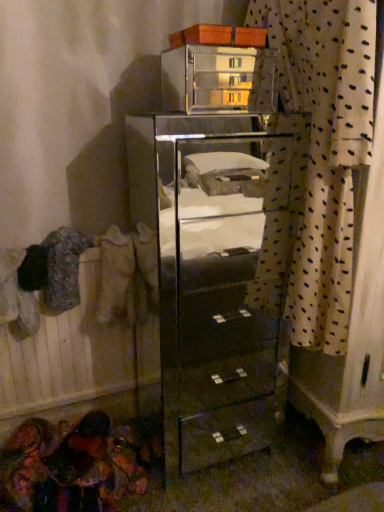
Question: From the image's perspective, does beige fabric at left appear lower than clear glass cabinet at center?

Choices:
 (A) yes
 (B) no

Answer: (B)

Question: Is beige fabric at left not close to clear glass cabinet at center?

Choices:
 (A) no
 (B) yes

Answer: (A)

Question: Considering the relative sizes of beige fabric at left and clear glass cabinet at center in the image provided, is beige fabric at left shorter than clear glass cabinet at center?

Choices:
 (A) yes
 (B) no

Answer: (A)

Question: Is clear glass cabinet at center surrounded by beige fabric at left?

Choices:
 (A) no
 (B) yes

Answer: (A)

Question: From a real-world perspective, does beige fabric at left sit lower than clear glass cabinet at center?

Choices:
 (A) yes
 (B) no

Answer: (B)

Question: From a real-world perspective, is beige fabric at left positioned over clear glass cabinet at center based on gravity?

Choices:
 (A) yes
 (B) no

Answer: (A)

Question: Considering the relative positions of clear glass cabinet at upper center and beige fabric at left in the image provided, is clear glass cabinet at upper center to the left of beige fabric at left from the viewer's perspective?

Choices:
 (A) yes
 (B) no

Answer: (B)

Question: Is clear glass cabinet at upper center outside beige fabric at left?

Choices:
 (A) no
 (B) yes

Answer: (B)

Question: From the image's perspective, is clear glass cabinet at upper center located above beige fabric at left?

Choices:
 (A) no
 (B) yes

Answer: (B)

Question: Considering the relative sizes of clear glass cabinet at upper center and beige fabric at left in the image provided, is clear glass cabinet at upper center bigger than beige fabric at left?

Choices:
 (A) yes
 (B) no

Answer: (A)

Question: Is clear glass cabinet at upper center not near beige fabric at left?

Choices:
 (A) yes
 (B) no

Answer: (A)

Question: From a real-world perspective, is clear glass cabinet at upper center physically above beige fabric at left?

Choices:
 (A) yes
 (B) no

Answer: (A)

Question: Can you confirm if white dotted fabric at right is wider than clear glass cabinet at center?

Choices:
 (A) no
 (B) yes

Answer: (A)